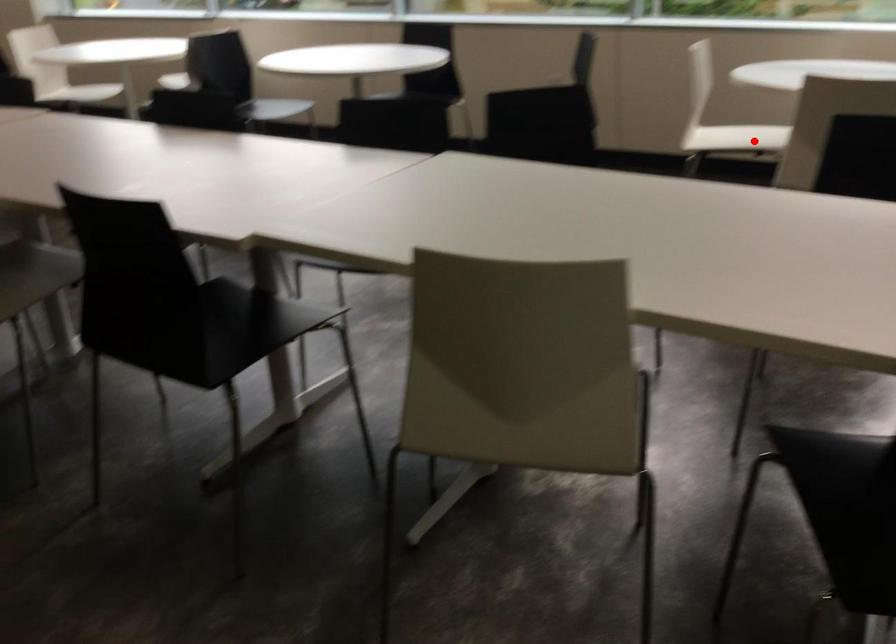
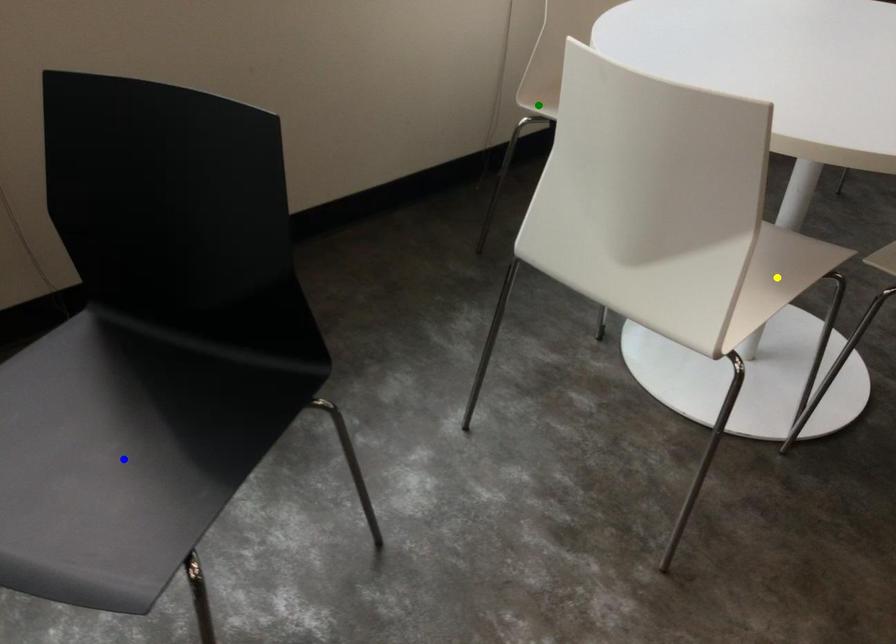
Question: I am providing you with two images of the same scene from different viewpoints. A red point is marked on the first image. You are given multiple points on the second image. Which mark in image 2 goes with the point in image 1?

Choices:
 (A) yellow point
 (B) green point
 (C) blue point

Answer: (A)